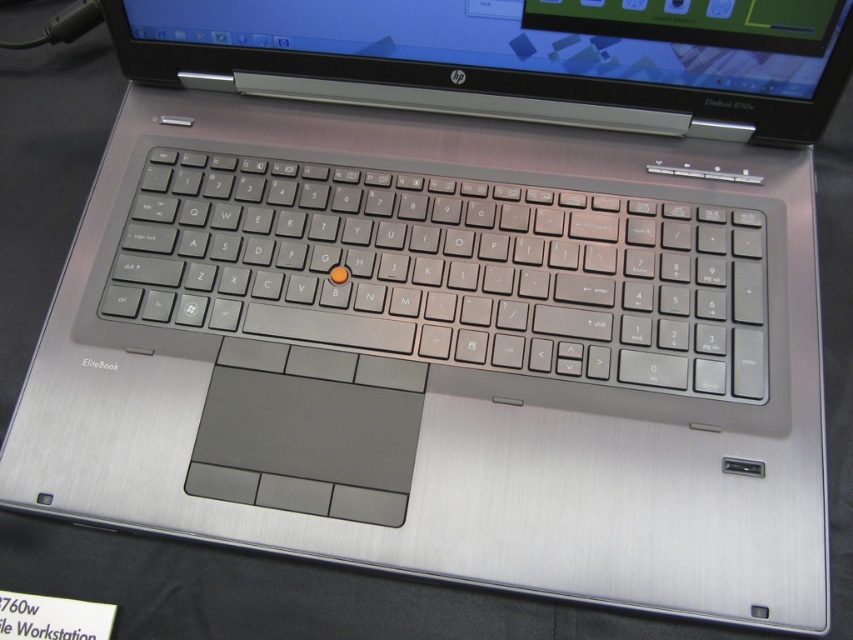
Question: Which point is closer to the camera?

Choices:
 (A) satin silver keyboard at center
 (B) brushed metal laptop at upper center

Answer: (A)

Question: Can you confirm if satin silver keyboard at center is wider than brushed metal laptop at upper center?

Choices:
 (A) yes
 (B) no

Answer: (B)

Question: In this image, where is satin silver keyboard at center located relative to brushed metal laptop at upper center?

Choices:
 (A) right
 (B) left

Answer: (B)

Question: Which point is closer to the camera?

Choices:
 (A) (746, 385)
 (B) (665, 58)

Answer: (A)

Question: Among these objects, which one is nearest to the camera?

Choices:
 (A) brushed metal laptop at upper center
 (B) satin silver keyboard at center

Answer: (B)

Question: Does satin silver keyboard at center appear on the left side of brushed metal laptop at upper center?

Choices:
 (A) yes
 (B) no

Answer: (A)